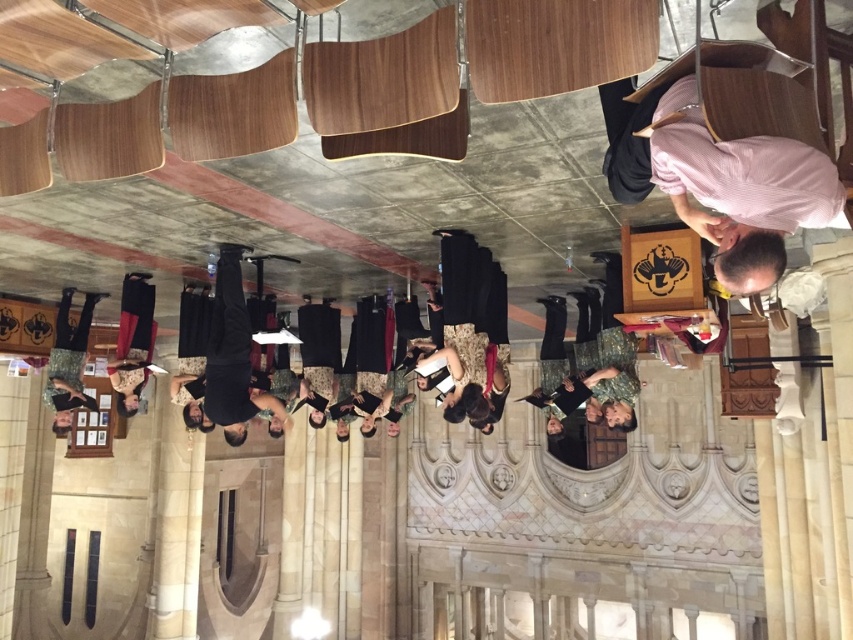
You are attending a formal event in a grand hall and notice two attendees dressed in a pink striped shirt at upper right and a black dress at lower left. Which one has a shorter length?

The pink striped shirt at upper right is shorter than the black dress at lower left.